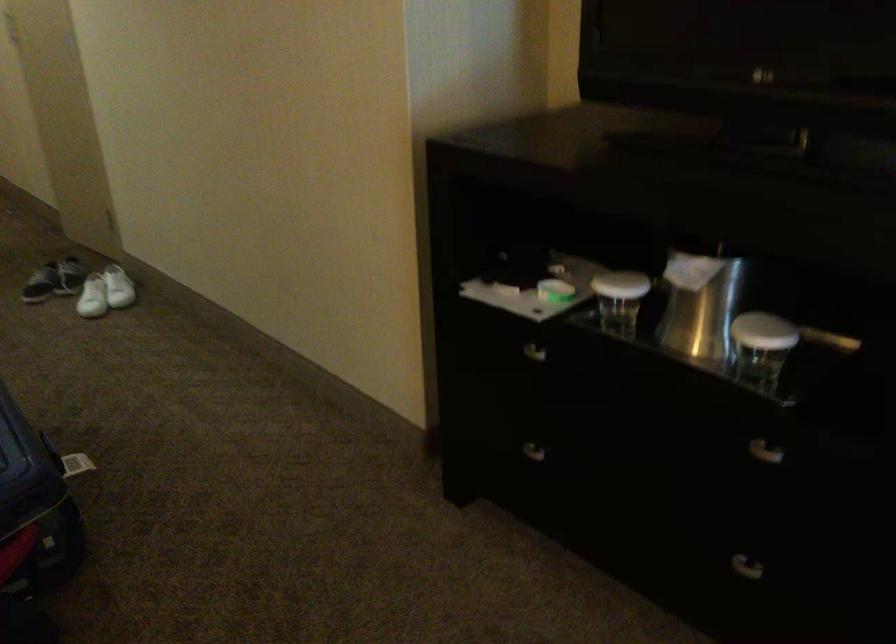
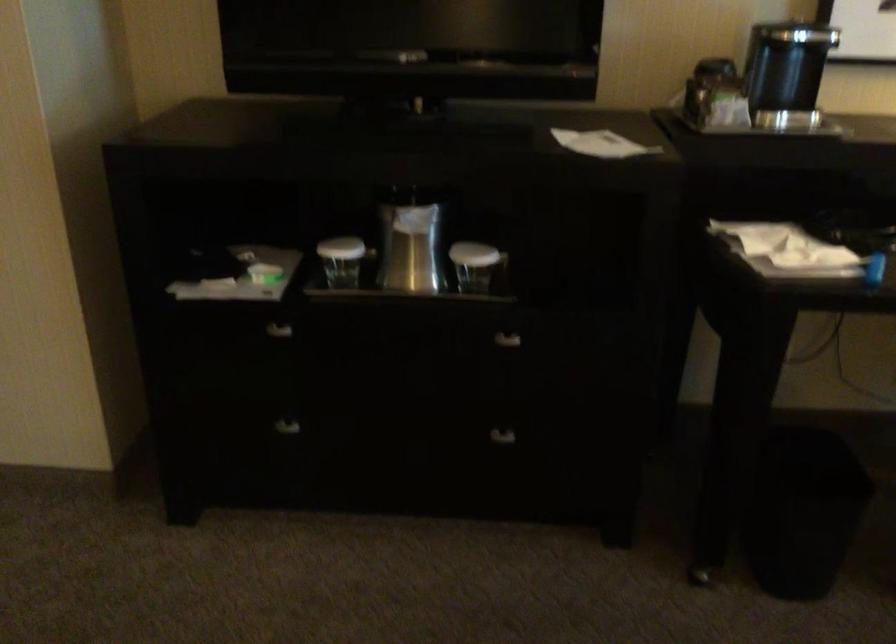
Locate, in the second image, the point that corresponds to the point at 803,446 in the first image.

(515, 337)